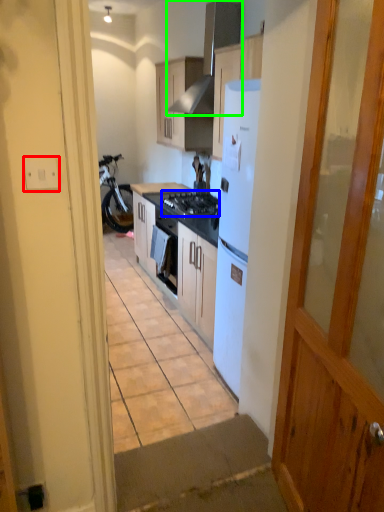
Question: Considering the real-world distances, which object is closest to electric outlet (highlighted by a red box)? gas stove (highlighted by a blue box) or kitchen appliance (highlighted by a green box).

Choices:
 (A) gas stove
 (B) kitchen appliance

Answer: (A)